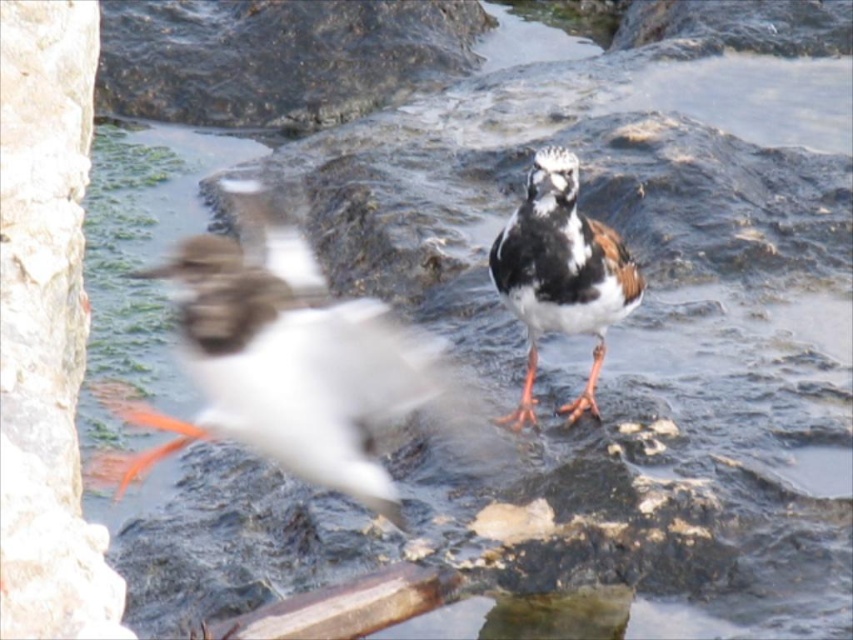
How far apart are stone at left and speckled feathered bird at center?

stone at left is 38.22 inches from speckled feathered bird at center.

Is point (22, 433) less distant than point (554, 257)?

Yes, it is in front of point (554, 257).

Does point (70, 163) lie behind point (590, 412)?

No, (70, 163) is closer to viewer.

I want to click on stone at left, so click(45, 326).

Is point (62, 397) behind point (183, 304)?

No, (62, 397) is closer to viewer.

Which is more to the right, stone at left or white glossy bird at center?

white glossy bird at center

The height and width of the screenshot is (640, 853). What do you see at coordinates (45, 326) in the screenshot?
I see `stone at left` at bounding box center [45, 326].

Identify the location of stone at left. (45, 326).

Is point (247, 392) less distant than point (585, 308)?

Yes.

In the scene shown: Measure the distance between point (213, 348) and camera.

Point (213, 348) and camera are 1.73 meters apart.

At what (x,y) coordinates should I click in order to perform the action: click on white glossy bird at center. Please return your answer as a coordinate pair (x, y). The width and height of the screenshot is (853, 640). Looking at the image, I should click on (286, 362).